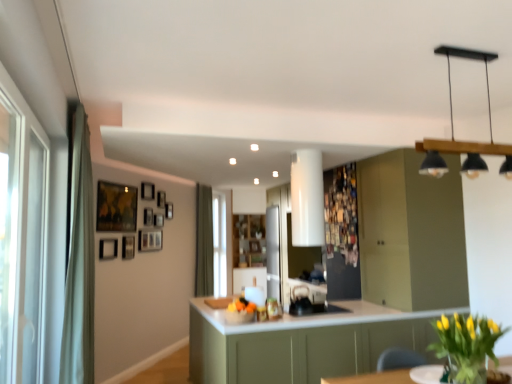
Question: Does matte black picture frame at upper left, placed as the 8th picture frame when sorted from back to front, have a lesser height compared to wooden picture frame at upper left, marked as the 1th picture frame in a back-to-front arrangement?

Choices:
 (A) yes
 (B) no

Answer: (B)

Question: From a real-world perspective, is matte black picture frame at upper left, arranged as the second picture frame when viewed from the front, below wooden picture frame at upper left, marked as the 1th picture frame in a back-to-front arrangement?

Choices:
 (A) no
 (B) yes

Answer: (B)

Question: Does matte black picture frame at upper left, placed as the 8th picture frame when sorted from back to front, lie behind wooden picture frame at upper left, marked as the 1th picture frame in a back-to-front arrangement?

Choices:
 (A) no
 (B) yes

Answer: (A)

Question: Are matte black picture frame at upper left, arranged as the second picture frame when viewed from the front, and wooden picture frame at upper left, the 9th picture frame from the front, beside each other?

Choices:
 (A) no
 (B) yes

Answer: (A)

Question: Is matte black picture frame at upper left, arranged as the second picture frame when viewed from the front, facing towards wooden picture frame at upper left, marked as the 1th picture frame in a back-to-front arrangement?

Choices:
 (A) yes
 (B) no

Answer: (B)

Question: Is point (165, 206) positioned closer to the camera than point (501, 367)?

Choices:
 (A) closer
 (B) farther

Answer: (B)

Question: Is wooden picture frame at upper left, marked as the 1th picture frame in a back-to-front arrangement, inside the boundaries of white glossy round table at lower right, or outside?

Choices:
 (A) inside
 (B) outside

Answer: (B)

Question: Looking at their shapes, would you say wooden picture frame at upper left, the 9th picture frame from the front, is wider or thinner than white glossy round table at lower right?

Choices:
 (A) thin
 (B) wide

Answer: (A)

Question: Would you say wooden picture frame at upper left, the 9th picture frame from the front, is to the left or to the right of white glossy round table at lower right in the picture?

Choices:
 (A) right
 (B) left

Answer: (B)

Question: Visually, is wooden picture frame at upper left, marked as the 1th picture frame in a back-to-front arrangement, positioned to the left or to the right of wooden picture frame at upper left, which is counted as the 6th picture frame, starting from the front?

Choices:
 (A) left
 (B) right

Answer: (B)

Question: In terms of size, does wooden picture frame at upper left, marked as the 1th picture frame in a back-to-front arrangement, appear bigger or smaller than wooden picture frame at upper left, the 4th picture frame viewed from the back?

Choices:
 (A) big
 (B) small

Answer: (B)

Question: From the image's perspective, is wooden picture frame at upper left, marked as the 1th picture frame in a back-to-front arrangement, above or below wooden picture frame at upper left, which is counted as the 6th picture frame, starting from the front?

Choices:
 (A) above
 (B) below

Answer: (A)

Question: In terms of height, does wooden picture frame at upper left, marked as the 1th picture frame in a back-to-front arrangement, look taller or shorter compared to wooden picture frame at upper left, which is counted as the 6th picture frame, starting from the front?

Choices:
 (A) short
 (B) tall

Answer: (B)

Question: Considering the positions of white glossy round table at lower right and wooden picture frame at upper center, which is the 6th picture frame from back to front, in the image, is white glossy round table at lower right taller or shorter than wooden picture frame at upper center, which is the 6th picture frame from back to front,?

Choices:
 (A) tall
 (B) short

Answer: (B)

Question: From the image's perspective, is white glossy round table at lower right positioned above or below wooden picture frame at upper center, positioned as the fourth picture frame in front-to-back order?

Choices:
 (A) above
 (B) below

Answer: (B)